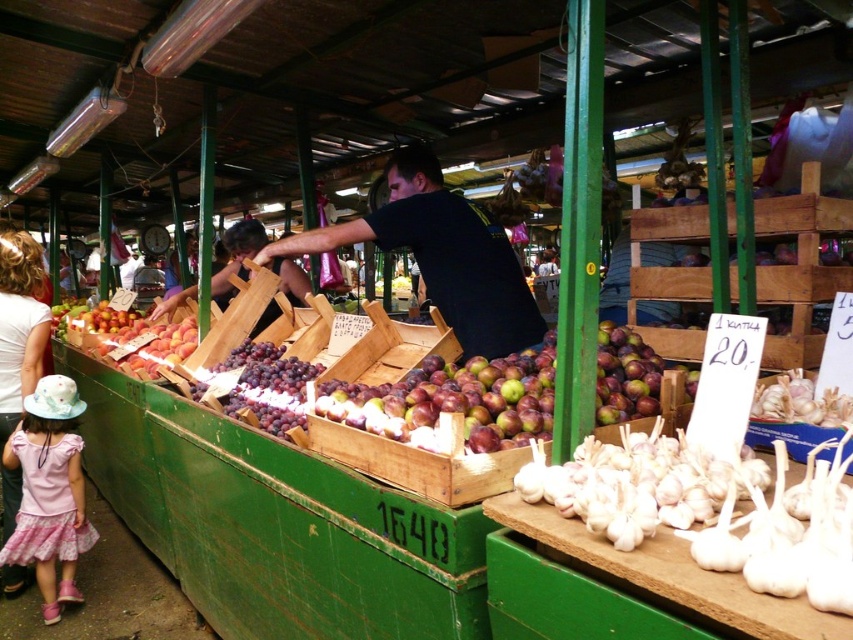
Question: Does black matte shirt at center appear on the right side of white cotton shirt at left?

Choices:
 (A) no
 (B) yes

Answer: (B)

Question: Can you confirm if pink floral dress at lower left is positioned above white cotton shirt at left?

Choices:
 (A) no
 (B) yes

Answer: (A)

Question: Considering the real-world distances, which object is farthest from the black matte shirt at center?

Choices:
 (A) pink floral dress at lower left
 (B) white cotton shirt at left

Answer: (B)

Question: Considering the real-world distances, which object is closest to the black matte shirt at center?

Choices:
 (A) white cotton shirt at left
 (B) pink floral dress at lower left

Answer: (B)

Question: Which point is farther to the camera?

Choices:
 (A) black matte shirt at center
 (B) white cotton shirt at left

Answer: (B)

Question: Is black matte shirt at center above white cotton shirt at left?

Choices:
 (A) yes
 (B) no

Answer: (A)